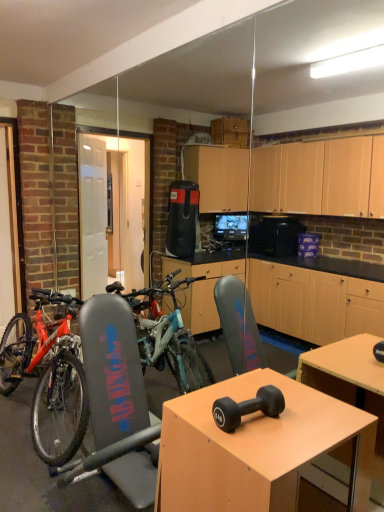
Question: Is matte wood desk at center bigger or smaller than black rubber dumbbell at center?

Choices:
 (A) small
 (B) big

Answer: (B)

Question: From a real-world perspective, is matte wood desk at center above or below black rubber dumbbell at center?

Choices:
 (A) below
 (B) above

Answer: (A)

Question: Based on their relative distances, which object is nearer to the matte wood desk at center?

Choices:
 (A) black rubber dumbbell at center
 (B) shiny metallic bicycle at left

Answer: (A)

Question: Based on their relative distances, which object is farther from the matte wood desk at center?

Choices:
 (A) black rubber dumbbell at center
 (B) shiny metallic bicycle at left

Answer: (B)